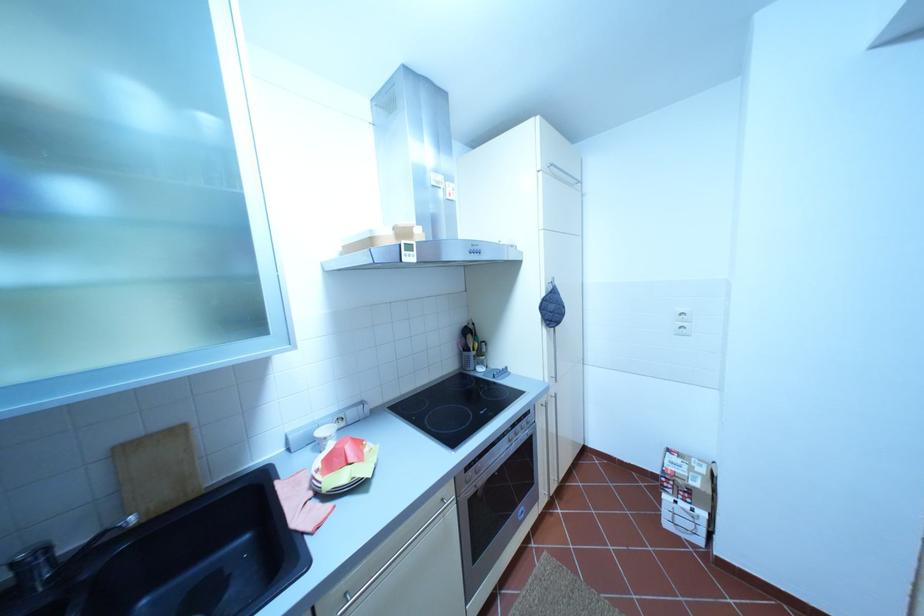
Describe the element at coordinates (687, 477) in the screenshot. I see `the small cardboard box` at that location.